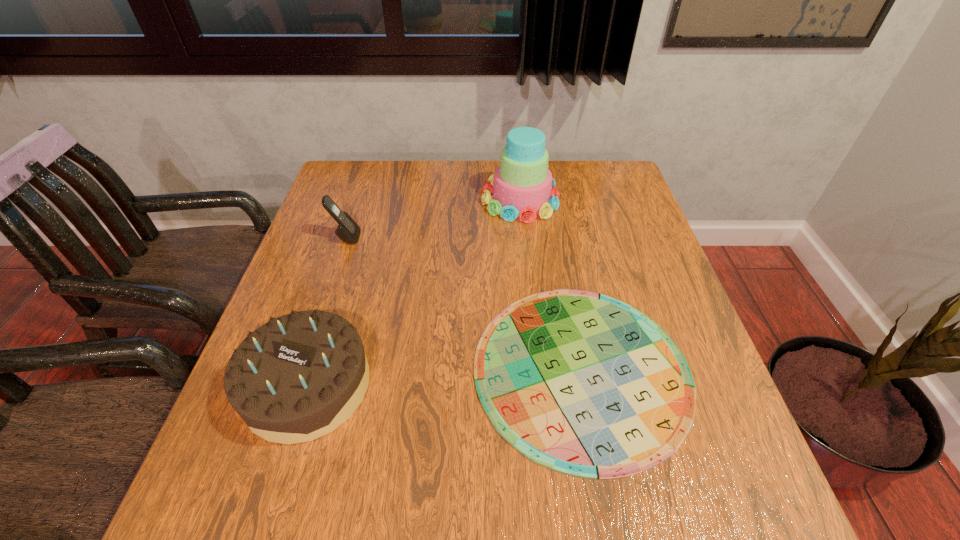
This screenshot has width=960, height=540. In order to click on the farthest object in this screenshot , I will do `click(523, 186)`.

This screenshot has width=960, height=540. What are the coordinates of `the tallest object` in the screenshot? It's located at (523, 186).

Locate an element on the screen. The image size is (960, 540). cellular telephone is located at coordinates (347, 230).

Find the location of `birthday cake`. birthday cake is located at coordinates (298, 377).

Where is `gameboard`? This screenshot has height=540, width=960. gameboard is located at coordinates (584, 384).

Find the location of a particular element. vacant space located on the left of the cake is located at coordinates (441, 199).

You are a GUI agent. You are given a task and a screenshot of the screen. Output one action in this format:
    pyautogui.click(x=<x>, y=<y>)
    Task: Click on the free space located on the front-facing side of the second farthest object
    The width and height of the screenshot is (960, 540).
    Given the screenshot: What is the action you would take?
    pyautogui.click(x=475, y=238)

Image resolution: width=960 pixels, height=540 pixels. I want to click on vacant position located 0.050m on the front-facing side of the birthday cake, so click(279, 475).

Locate an element on the screen. This screenshot has height=540, width=960. free space located on the left of the gameboard is located at coordinates (366, 369).

Find the location of a particular element. object located in the far edge section of the desktop is located at coordinates (523, 186).